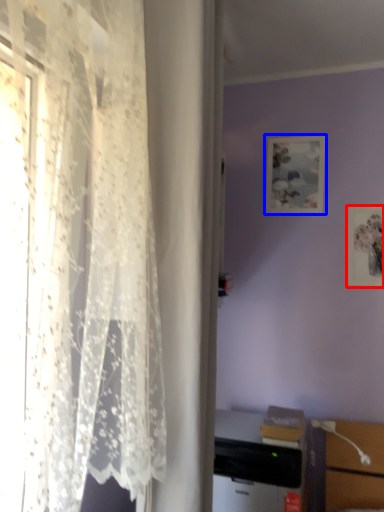
Question: Among these objects, which one is farthest to the camera, picture frame (highlighted by a red box) or picture frame (highlighted by a blue box)?

Choices:
 (A) picture frame
 (B) picture frame

Answer: (B)